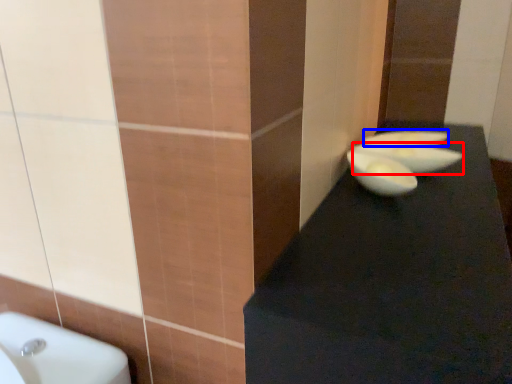
Question: Which of the following is the closest to the observer, basin (highlighted by a red box) or basin (highlighted by a blue box)?

Choices:
 (A) basin
 (B) basin

Answer: (A)